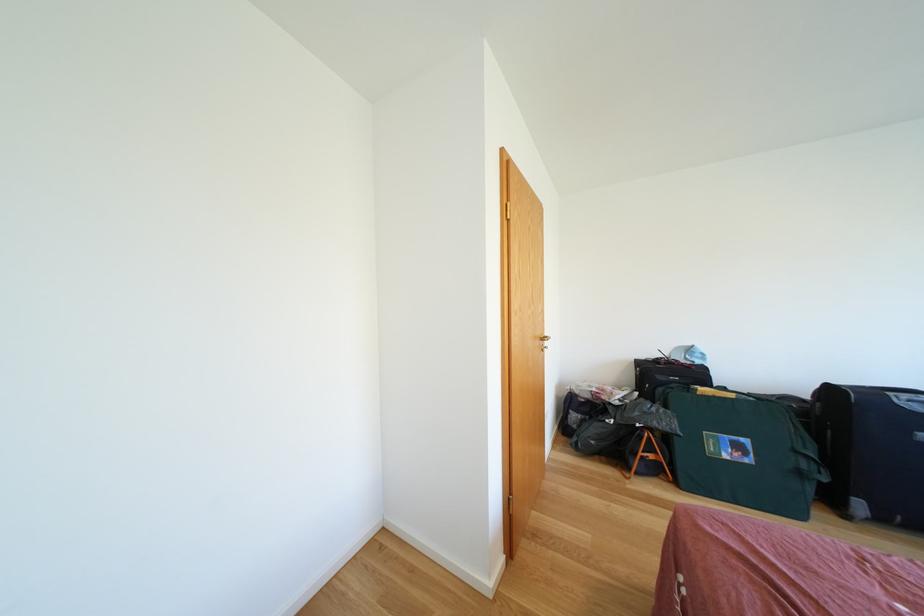
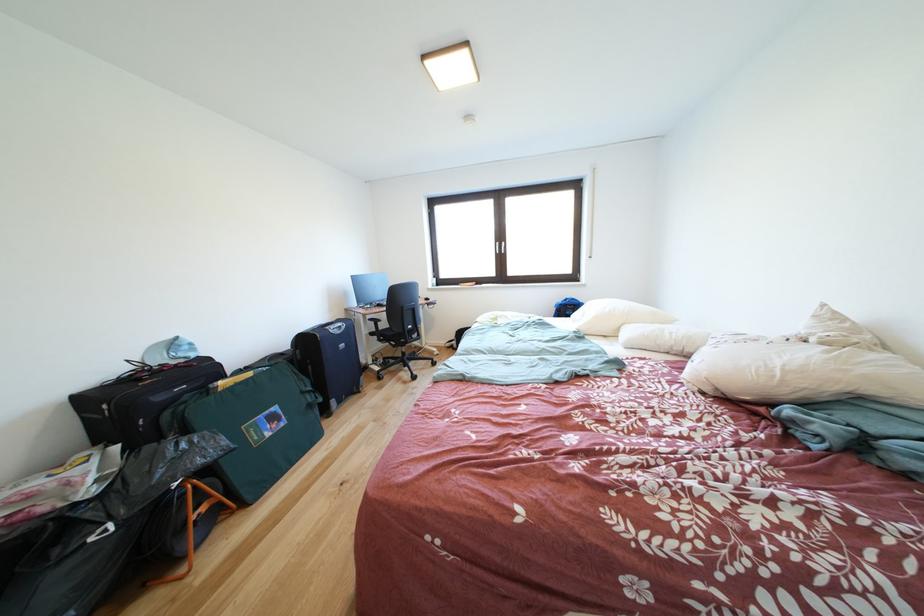
Where in the second image is the point corresponding to (662,414) from the first image?

(191, 450)